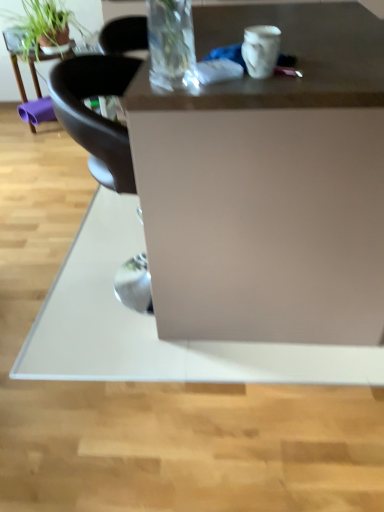
Question: Is matte white desk at center oriented towards matte black table at upper left?

Choices:
 (A) yes
 (B) no

Answer: (B)

Question: Does matte white desk at center have a larger size compared to matte black table at upper left?

Choices:
 (A) no
 (B) yes

Answer: (B)

Question: Is matte white desk at center positioned in front of matte black table at upper left?

Choices:
 (A) yes
 (B) no

Answer: (A)

Question: Are matte white desk at center and matte black table at upper left far apart?

Choices:
 (A) no
 (B) yes

Answer: (B)

Question: Can you confirm if matte white desk at center is positioned to the left of matte black table at upper left?

Choices:
 (A) no
 (B) yes

Answer: (A)

Question: Is green matte plant at upper left wider or thinner than matte white desk at center?

Choices:
 (A) thin
 (B) wide

Answer: (A)

Question: Is point (23, 8) positioned closer to the camera than point (339, 124)?

Choices:
 (A) closer
 (B) farther

Answer: (B)

Question: From their relative heights in the image, would you say green matte plant at upper left is taller or shorter than matte white desk at center?

Choices:
 (A) tall
 (B) short

Answer: (B)

Question: In the image, is green matte plant at upper left positioned in front of or behind matte white desk at center?

Choices:
 (A) front
 (B) behind

Answer: (B)

Question: From their relative heights in the image, would you say green matte plant at upper left is taller or shorter than matte black table at upper left?

Choices:
 (A) short
 (B) tall

Answer: (A)

Question: Is green matte plant at upper left in front of or behind matte black table at upper left in the image?

Choices:
 (A) behind
 (B) front

Answer: (B)

Question: Is green matte plant at upper left situated inside matte black table at upper left or outside?

Choices:
 (A) inside
 (B) outside

Answer: (B)

Question: Considering the positions of green matte plant at upper left and matte black table at upper left in the image, is green matte plant at upper left bigger or smaller than matte black table at upper left?

Choices:
 (A) small
 (B) big

Answer: (B)

Question: Considering the positions of matte black table at upper left and green matte plant at upper left in the image, is matte black table at upper left taller or shorter than green matte plant at upper left?

Choices:
 (A) tall
 (B) short

Answer: (A)

Question: From the image's perspective, relative to green matte plant at upper left, is matte black table at upper left above or below?

Choices:
 (A) below
 (B) above

Answer: (A)